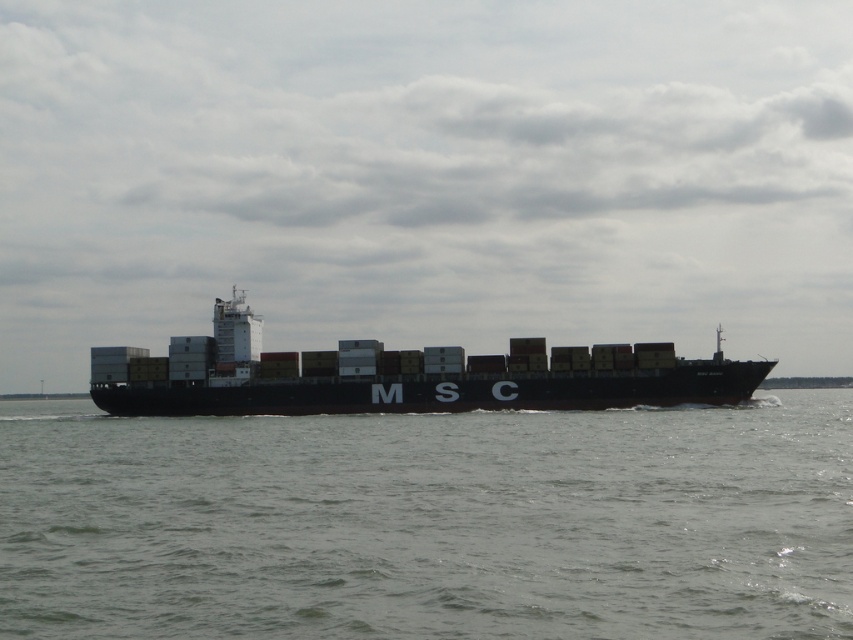
You are a drone operator trying to capture a photo of the black matte container ship at center from above. The drone has a maximum flight altitude of 100 meters. Considering the height of the gray matte water at center compared to the ship, is there enough clearance for the drone to fly safely above both?

The gray matte water at center is shorter than the black matte container ship at center, so the drone must fly above the ship to ensure clearance. Since the ship is taller than the water, the drone can safely fly at its maximum altitude of 100 meters as long as it stays above the ship.

You are an observer on the deck of the MSC container ship. You notice two points marked on the ship. One is at point coordinates point (643, 584) and the other at point (583, 396). Which point is closer to you?

Point (643, 584) is closer to the viewer than point (583, 396).

You are a drone operator tasked with capturing aerial footage of the gray matte water at center and the black matte container ship at center. Your drone has a maximum range of 50 feet. Can the drone safely capture footage of both objects without exceeding its range limit?

The gray matte water at center and black matte container ship at center are 45.24 feet apart. Since the drone has a maximum range of 50 feet, it can safely capture footage of both objects as the distance between them is within the drone operator range limit.